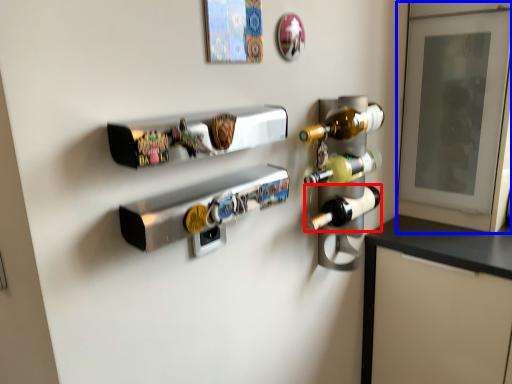
Question: Which point is further to the camera, bottle (highlighted by a red box) or glass door (highlighted by a blue box)?

Choices:
 (A) bottle
 (B) glass door

Answer: (B)